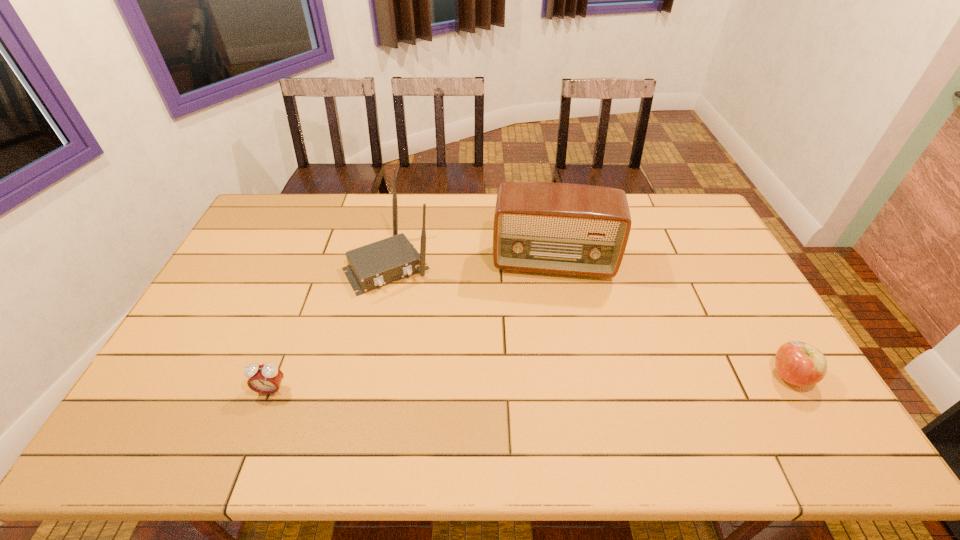
Identify the location of free space between the router and the rightmost object. (589, 321).

Select which object appears as the third closest to the router. Please provide its 2D coordinates. Your answer should be formatted as a tuple, i.e. [(x, y)], where the tuple contains the x and y coordinates of a point satisfying the conditions above.

[(798, 363)]

Find the location of a particular element. the third closest object to the apple is located at coordinates (265, 379).